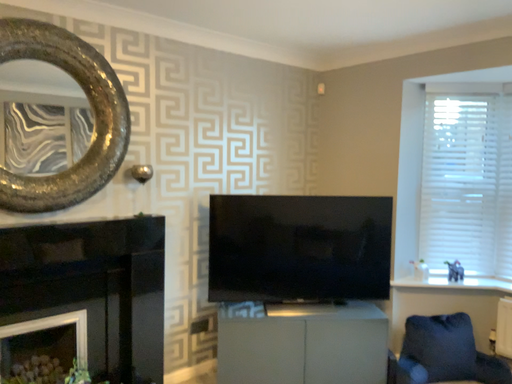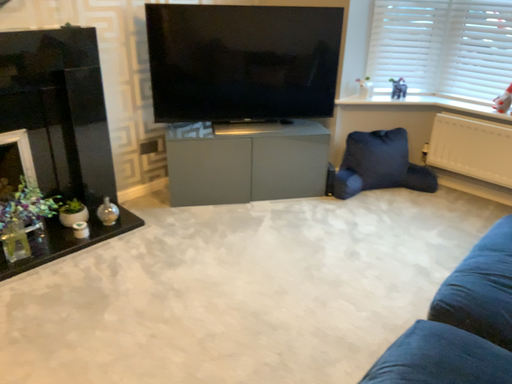
Question: How did the camera likely rotate when shooting the video?

Choices:
 (A) rotated upward
 (B) rotated downward

Answer: (B)